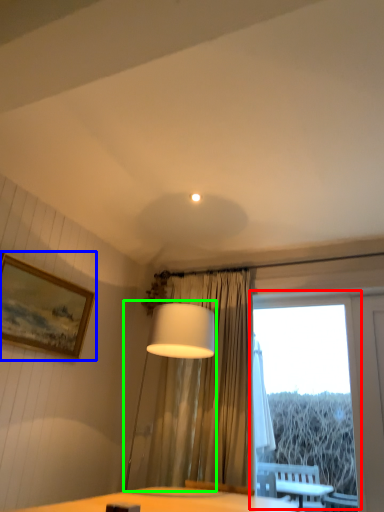
Question: Based on their relative distances, which object is nearer to window (highlighted by a red box)? Choose from picture frame (highlighted by a blue box) and table lamp (highlighted by a green box).

Choices:
 (A) picture frame
 (B) table lamp

Answer: (B)